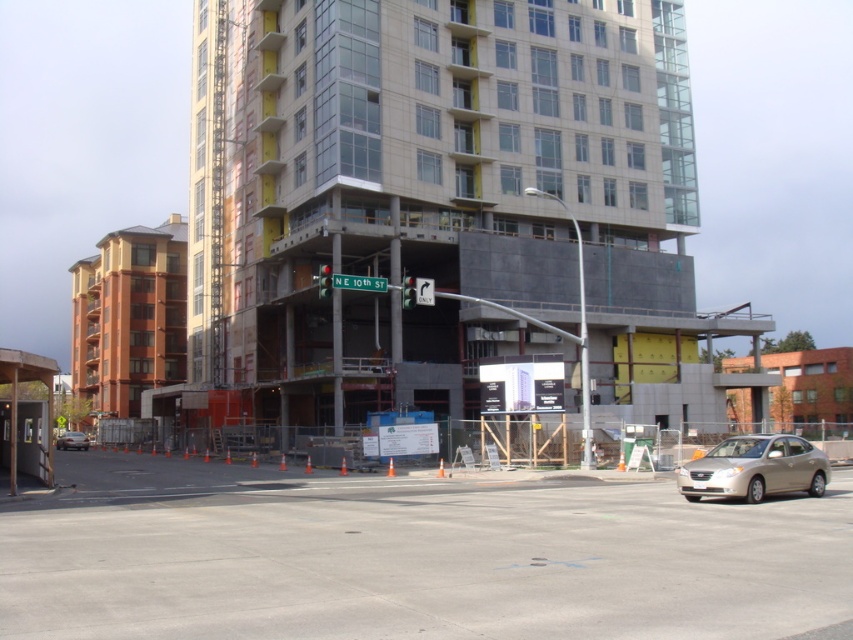
You are a pedestrian crossing NE 10th Street and see the gold metallic sedan at lower right and the red glass traffic light at center. Which object is closer to the ground?

The gold metallic sedan at lower right is located below the red glass traffic light at center, so it is closer to the ground.

You are a delivery driver approaching the construction site and need to locate the NE 10th Street sign. According to the image, where exactly is the green metallic street sign at upper center positioned?

The green metallic street sign at upper center is positioned at the coordinates point [358,282].

You are a drone operator tasked with capturing aerial footage of the construction site. Your drone needs to maintain a minimum distance of 100 feet from any objects to avoid collisions. Based on the scene, will the drone be able to safely fly at the required distance while capturing the green metallic street sign at upper center?

The green metallic street sign at upper center is only 95.38 feet away from the camera, which is less than the required 100 feet minimum distance. Therefore, the drone cannot safely fly at the required distance while capturing the green metallic street sign at upper center.